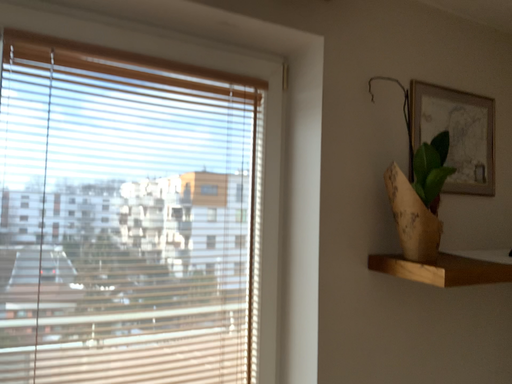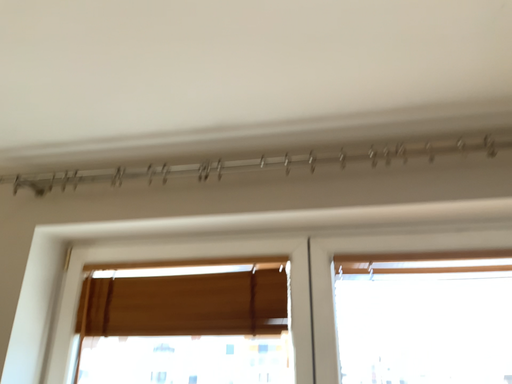
Question: Which way did the camera rotate in the video?

Choices:
 (A) rotated upward
 (B) rotated downward

Answer: (A)